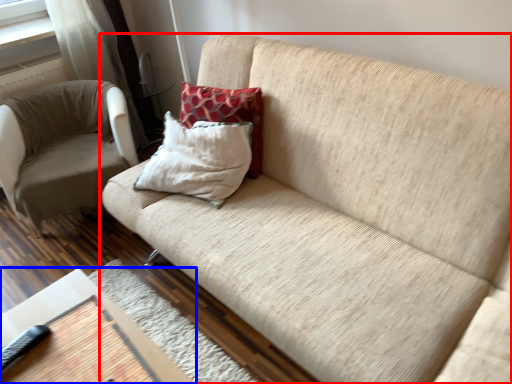
Question: Which point is further to the camera, studio couch (highlighted by a red box) or table (highlighted by a blue box)?

Choices:
 (A) studio couch
 (B) table

Answer: (B)